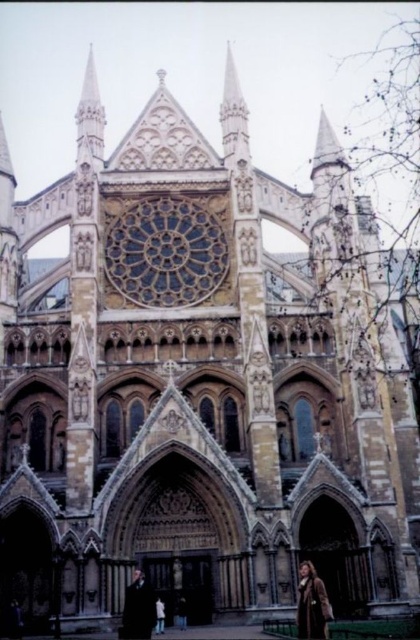
Does smooth white spire at upper left have a greater width compared to brown leather coat at lower right?

Indeed, smooth white spire at upper left has a greater width compared to brown leather coat at lower right.

Who is taller, smooth white spire at upper left or brown leather coat at lower right?

With more height is smooth white spire at upper left.

Between point (100, 115) and point (320, 586), which one is positioned behind?

Point (100, 115)

Find the location of a particular element. smooth white spire at upper left is located at coordinates (89, 120).